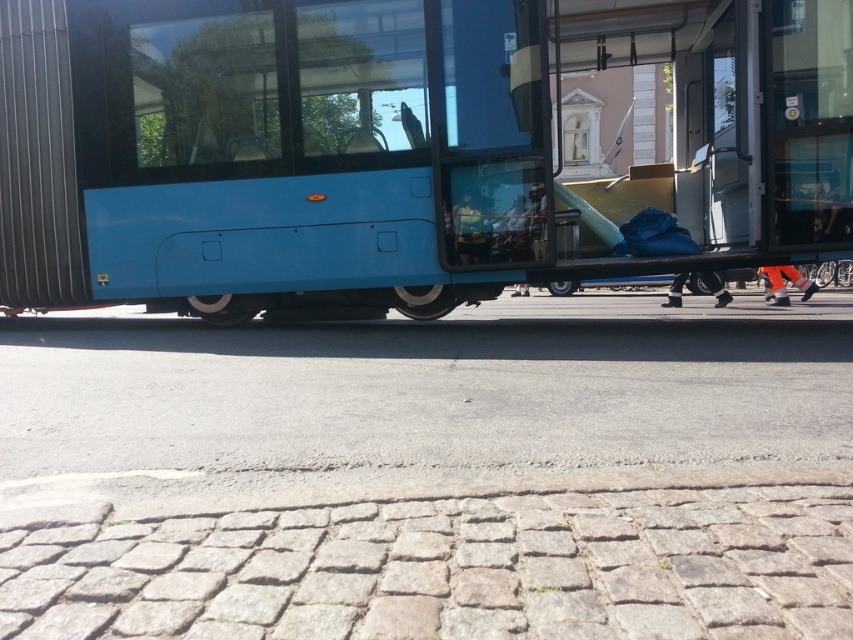
Which is behind, point (595, 404) or point (779, 296)?

The point (779, 296) is behind.

Looking at this image, is gray asphalt at center above orange fabric pants at lower right?

Incorrect, gray asphalt at center is not positioned above orange fabric pants at lower right.

Identify the location of gray asphalt at center. (431, 474).

Which is behind, point (192, 628) or point (547, 116)?

Positioned behind is point (547, 116).

Does gray asphalt at center come in front of blue matte bus at center?

That is True.

Does point (55, 541) come closer to viewer compared to point (682, 109)?

Yes, point (55, 541) is closer to viewer.

What are the coordinates of `gray asphalt at center` in the screenshot? It's located at (431, 474).

Is point (231, 20) less distant than point (802, 280)?

Yes, it is.

Is blue matte bus at center positioned at the back of orange fabric pants at lower right?

No, blue matte bus at center is in front of orange fabric pants at lower right.

Does point (190, 76) come behind point (784, 288)?

No, it is not.

The height and width of the screenshot is (640, 853). Identify the location of blue matte bus at center. (397, 148).